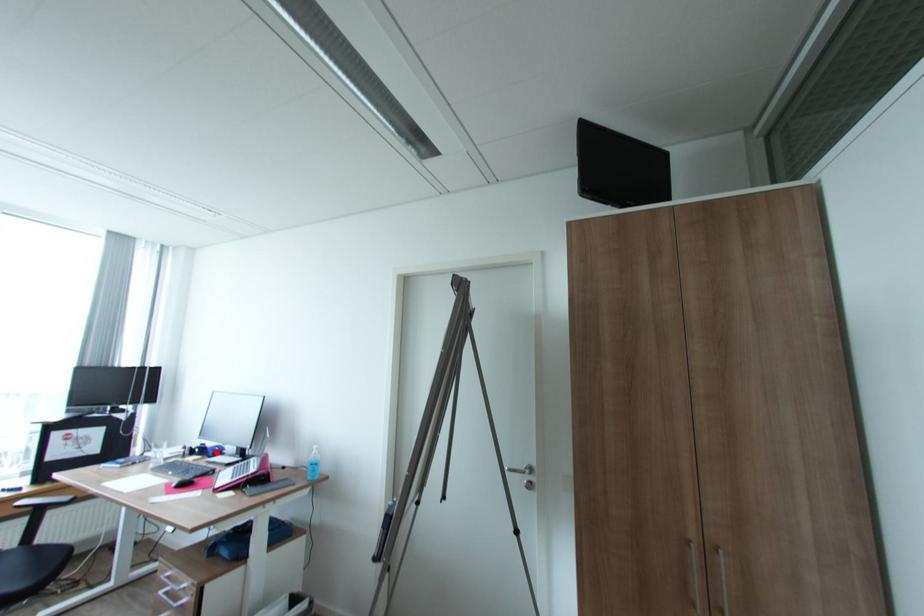
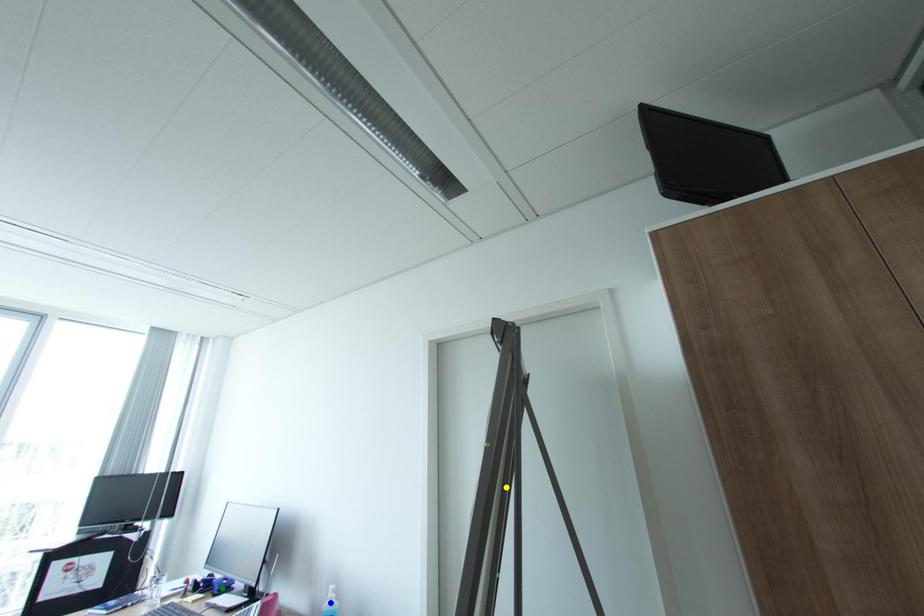
Question: I am providing you with two images of the same scene from different viewpoints. A red point is marked on the first image. You are given multiple points on the second image. Which mark in image 2 goes with the point in image 1?

Choices:
 (A) blue point
 (B) yellow point
 (C) green point

Answer: (C)